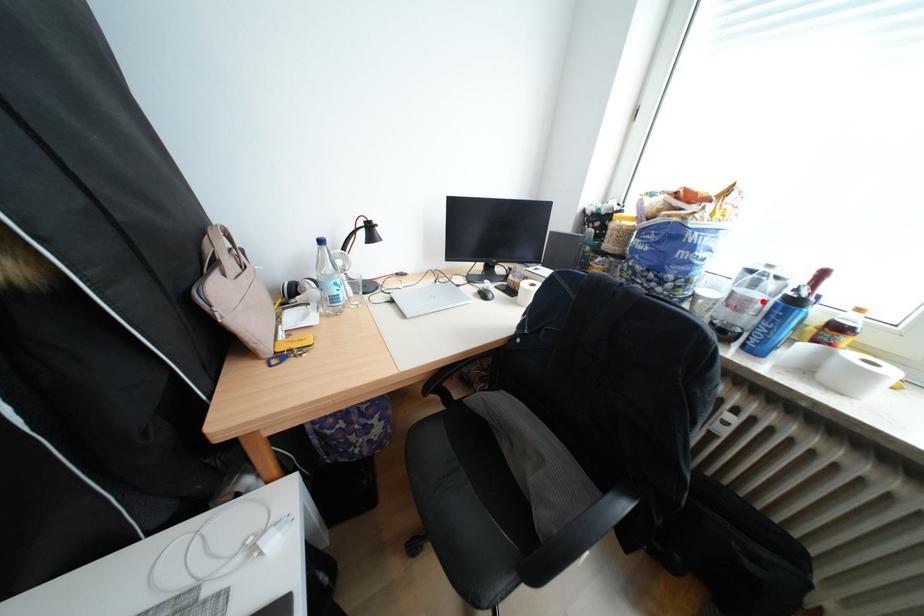
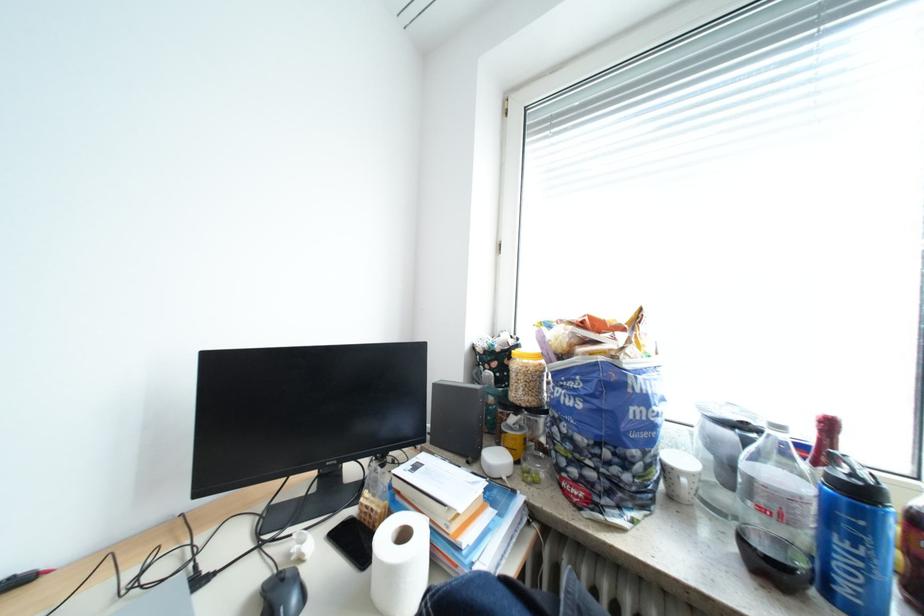
The point at the highlighted location is marked in the first image. Where is the corresponding point in the second image?

(807, 499)